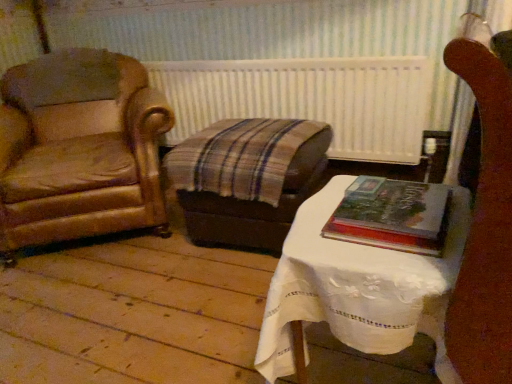
Question: Is white lace-covered table at center at the right side of hardcover book at center right?

Choices:
 (A) no
 (B) yes

Answer: (A)

Question: Can you confirm if white lace-covered table at center is shorter than hardcover book at center right?

Choices:
 (A) yes
 (B) no

Answer: (B)

Question: Is white lace-covered table at center looking in the opposite direction of hardcover book at center right?

Choices:
 (A) no
 (B) yes

Answer: (A)

Question: Does white lace-covered table at center have a lesser width compared to hardcover book at center right?

Choices:
 (A) no
 (B) yes

Answer: (A)

Question: From the image's perspective, is white lace-covered table at center under hardcover book at center right?

Choices:
 (A) yes
 (B) no

Answer: (A)

Question: Is white lace-covered table at center taller than hardcover book at center right?

Choices:
 (A) no
 (B) yes

Answer: (B)

Question: Does brown leather armchair at left have a greater width compared to hardcover book at center right?

Choices:
 (A) no
 (B) yes

Answer: (B)

Question: From the image's perspective, is brown leather armchair at left on hardcover book at center right?

Choices:
 (A) no
 (B) yes

Answer: (B)

Question: Is brown leather armchair at left positioned in front of hardcover book at center right?

Choices:
 (A) no
 (B) yes

Answer: (A)

Question: Can you confirm if brown leather armchair at left is smaller than hardcover book at center right?

Choices:
 (A) yes
 (B) no

Answer: (B)

Question: Is brown leather armchair at left completely or partially outside of hardcover book at center right?

Choices:
 (A) no
 (B) yes

Answer: (B)

Question: Is brown leather armchair at left next to hardcover book at center right?

Choices:
 (A) yes
 (B) no

Answer: (B)

Question: From a real-world perspective, is hardcover book at center right positioned over white textured radiator at center based on gravity?

Choices:
 (A) yes
 (B) no

Answer: (A)